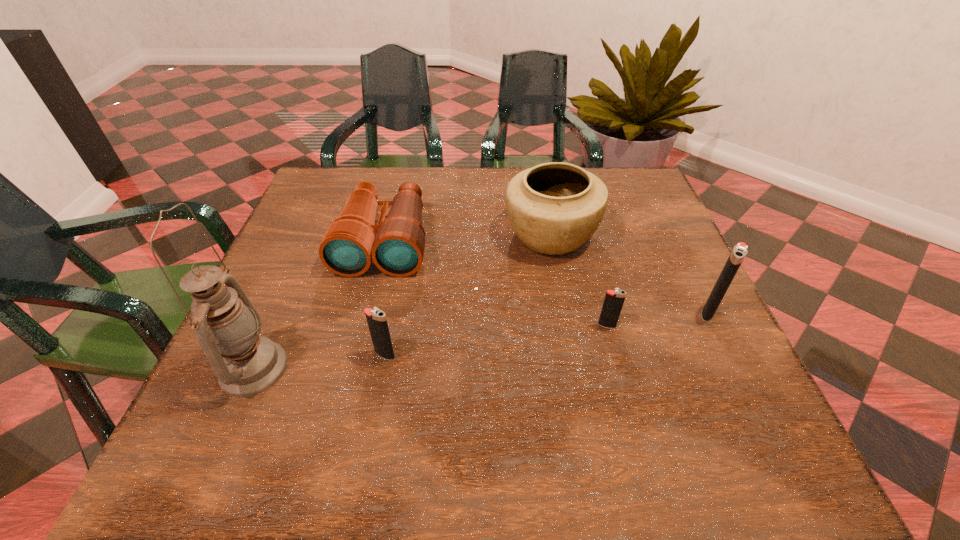
Locate an element on the screen. oil lamp located at the left edge is located at coordinates (227, 326).

You are a GUI agent. You are given a task and a screenshot of the screen. Output one action in this format:
    pyautogui.click(x=<x>, y=<y>)
    Task: Click on the object located in the right edge section of the desktop
    The image size is (960, 540).
    Given the screenshot: What is the action you would take?
    pyautogui.click(x=739, y=251)

This screenshot has width=960, height=540. Find the location of `object at the far left corner`. object at the far left corner is located at coordinates (396, 245).

This screenshot has height=540, width=960. I want to click on object present at the near left corner, so click(x=227, y=326).

Where is `vacant region at the far edge`? vacant region at the far edge is located at coordinates (400, 172).

Identify the location of vacant space at the near edge of the desktop. This screenshot has width=960, height=540. click(445, 376).

Find the location of `vacant area at the left edge`. vacant area at the left edge is located at coordinates (290, 365).

Locate an element on the screen. free point at the right edge is located at coordinates (683, 343).

The image size is (960, 540). Find the location of `vacant space at the far left corner`. vacant space at the far left corner is located at coordinates (328, 196).

Image resolution: width=960 pixels, height=540 pixels. In the image, there is a desktop. Find the location of `vacant region at the far right corner`. vacant region at the far right corner is located at coordinates (615, 197).